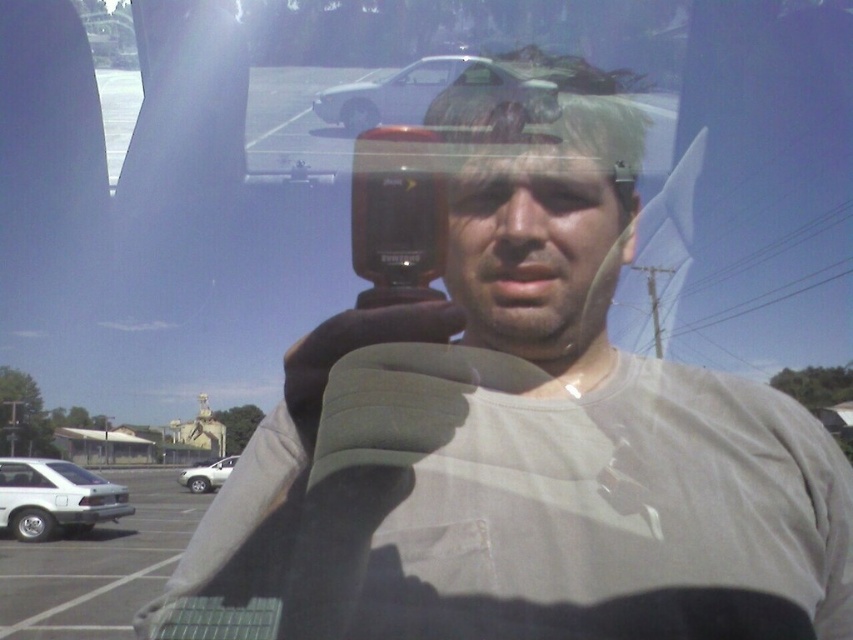
Question: Can you confirm if white matte car at lower left is bigger than silver metallic sedan at lower left?

Choices:
 (A) no
 (B) yes

Answer: (B)

Question: Does silver metallic sedan at lower left have a greater width compared to silver metallic suv at lower left?

Choices:
 (A) yes
 (B) no

Answer: (A)

Question: Can you confirm if silver metallic sedan at lower left is positioned above silver metallic suv at lower left?

Choices:
 (A) no
 (B) yes

Answer: (B)

Question: Which point is closer to the camera?

Choices:
 (A) silver metallic car at upper center
 (B) silver metallic sedan at lower left

Answer: (A)

Question: Which point is closer to the camera taking this photo?

Choices:
 (A) (440, 60)
 (B) (10, 483)
 (C) (90, 540)

Answer: (A)

Question: Which of the following is the farthest from the observer?

Choices:
 (A) (392, 76)
 (B) (38, 465)
 (C) (97, 596)
 (D) (233, 458)

Answer: (D)